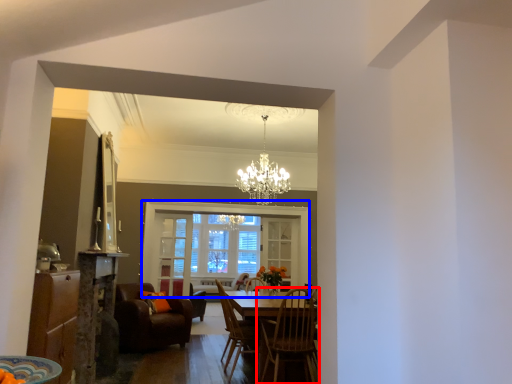
Question: Which point is further to the camera, chair (highlighted by a red box) or window (highlighted by a blue box)?

Choices:
 (A) chair
 (B) window

Answer: (B)